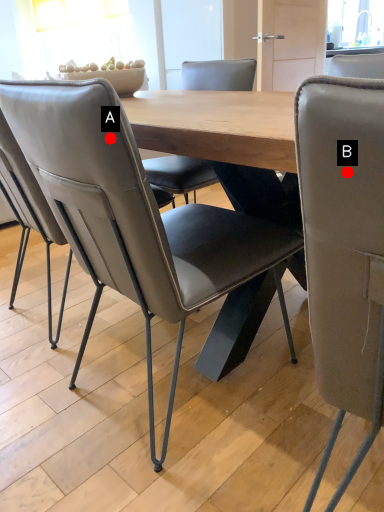
Question: Two points are circled on the image, labeled by A and B beside each circle. Which point is closer to the camera?

Choices:
 (A) A is closer
 (B) B is closer

Answer: (B)